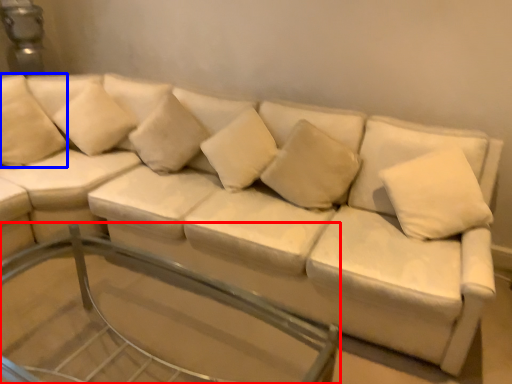
Question: Which point is further to the camera, glass table (highlighted by a red box) or pillow (highlighted by a blue box)?

Choices:
 (A) glass table
 (B) pillow

Answer: (B)